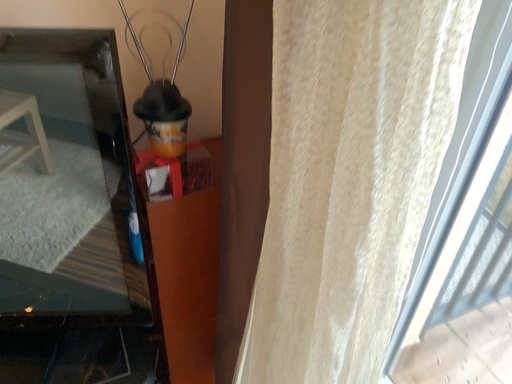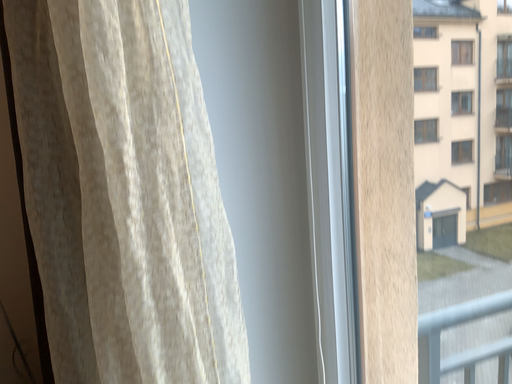
Question: Which way did the camera rotate in the video?

Choices:
 (A) rotated upward
 (B) rotated downward

Answer: (A)